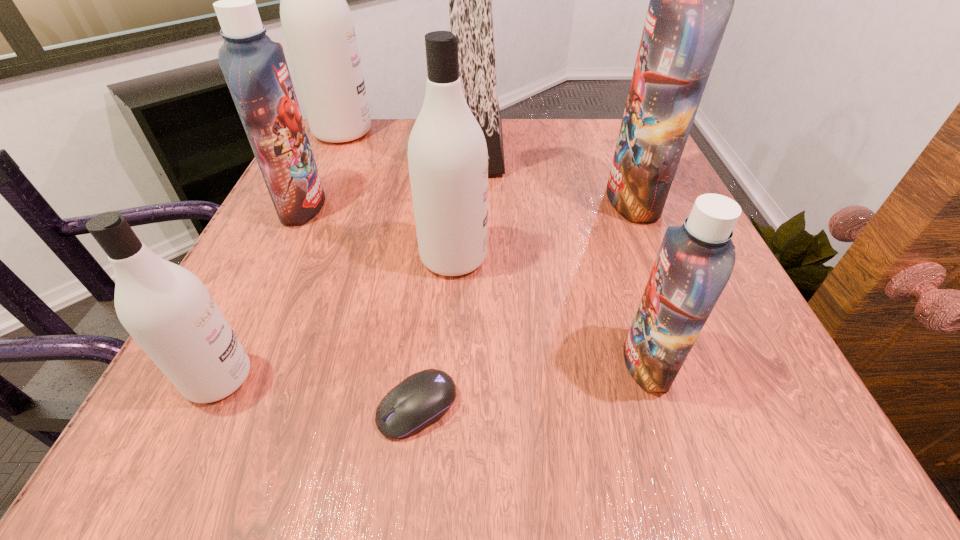
Identify the location of free space between the nearest white shampoo and the black computer mouse. Image resolution: width=960 pixels, height=540 pixels. (318, 393).

I want to click on free point between the farthest shampoo and the smallest blue shampoo, so click(495, 247).

Locate an element on the screen. The image size is (960, 540). the closest object to the computer mouse is located at coordinates (168, 311).

Identify which object is located as the nearest to the nearest white shampoo. Please provide its 2D coordinates. Your answer should be formatted as a tuple, i.e. [(x, y)], where the tuple contains the x and y coordinates of a point satisfying the conditions above.

[(423, 398)]

Find the location of a particular element. shampoo identified as the third closest to the nearest white shampoo is located at coordinates pyautogui.click(x=695, y=261).

Locate which shampoo is the second closest to the leftmost blue shampoo. Please provide its 2D coordinates. Your answer should be formatted as a tuple, i.e. [(x, y)], where the tuple contains the x and y coordinates of a point satisfying the conditions above.

[(447, 152)]

Identify which white shampoo is located as the nearest to the biggest white shampoo. Please provide its 2D coordinates. Your answer should be formatted as a tuple, i.e. [(x, y)], where the tuple contains the x and y coordinates of a point satisfying the conditions above.

[(447, 152)]

Identify which white shampoo is the second closest to the nearest white shampoo. Please provide its 2D coordinates. Your answer should be formatted as a tuple, i.e. [(x, y)], where the tuple contains the x and y coordinates of a point satisfying the conditions above.

[(317, 23)]

Identify the location of blue shampoo that is the third closest to the shopping bag. (695, 261).

Find the location of `the second closest blue shampoo relative to the fifth farthest object`. the second closest blue shampoo relative to the fifth farthest object is located at coordinates (695, 261).